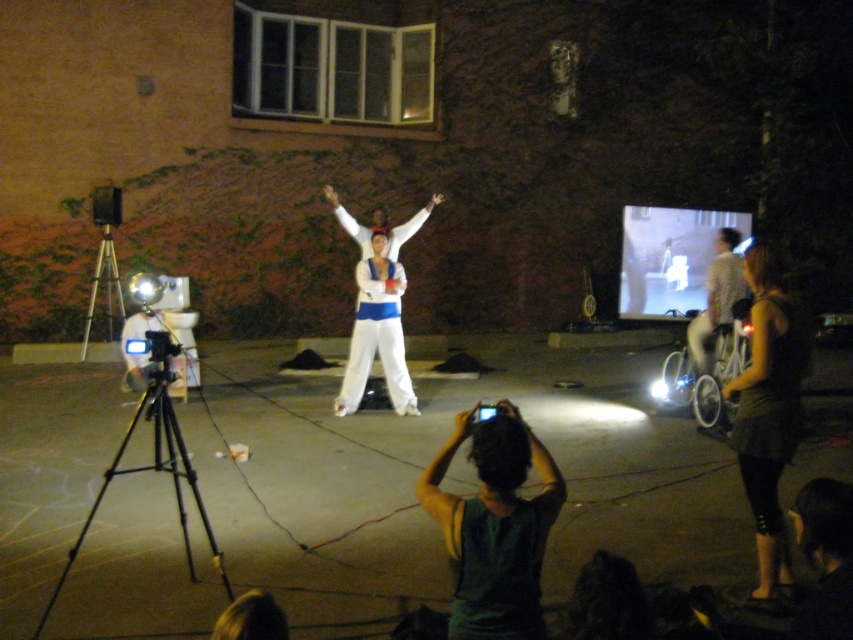
From the picture: You are setting up a lighting rig for the performance. You need to place a spotlight that can reach both the dark green tank top at lower right and the black matte tripod at lower left. Since the spotlight has a fixed height, which object will require the spotlight to be angled downward more?

The dark green tank top at lower right has a greater height compared to the black matte tripod at lower left, so the spotlight will need to be angled downward more to illuminate the taller dark green tank top at lower right.

You are setting up a projector for a presentation. The projector can only project onto surfaces taller than 1.5 meters. Based on the scene, will the matte white screen at center and the white fabric bicycle at right both be suitable for projecting onto?

The matte white screen at center has a greater height compared to white fabric bicycle at right. Since the screen is taller than the bicycle, and if the screen is over 1.5 meters in height, it would be suitable. However, without knowing the exact height of the screen, we can only confirm that the screen is taller than the bicycle. If the bicycle is under 1.5 meters, the screen might still qualify. More information is needed.